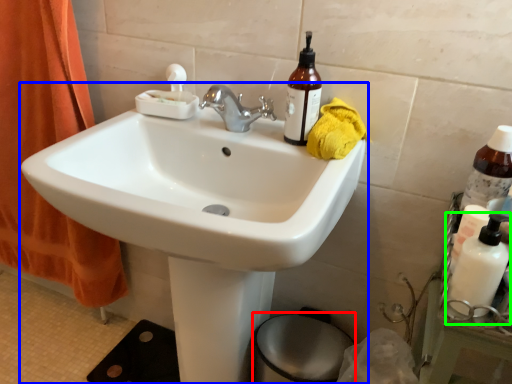
Question: Which object is positioned closest to bidet (highlighted by a red box)? Select from sink (highlighted by a blue box) and cleaning product (highlighted by a green box).

Choices:
 (A) sink
 (B) cleaning product

Answer: (A)